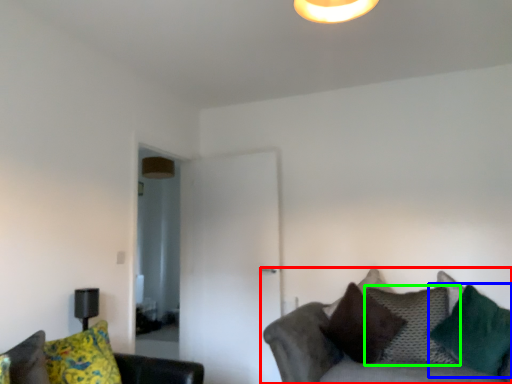
Question: Estimate the real-world distances between objects in this image. Which object is farther from studio couch (highlighted by a red box), pillow (highlighted by a blue box) or pillow (highlighted by a green box)?

Choices:
 (A) pillow
 (B) pillow

Answer: (A)